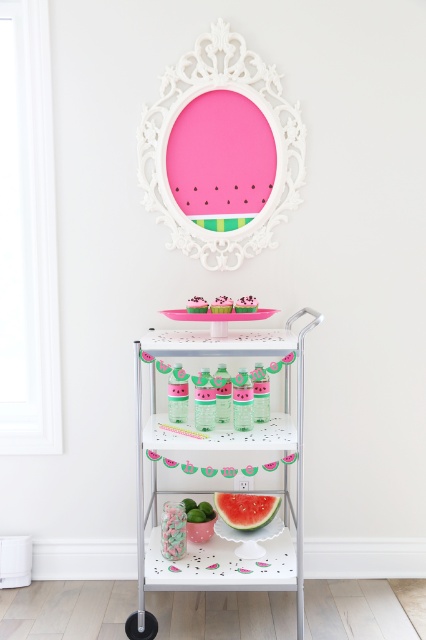
Question: Which point is closer to the camera?

Choices:
 (A) (242, 506)
 (B) (201, 518)
 (C) (204, 506)

Answer: (B)

Question: Which point is closer to the camera taking this photo?

Choices:
 (A) (271, 502)
 (B) (210, 516)
 (C) (287, 362)
 (D) (203, 513)

Answer: (C)

Question: From the image, what is the correct spatial relationship of black rubber wheel at lower left in relation to green matte lime at lower center?

Choices:
 (A) below
 (B) above

Answer: (A)

Question: Among these points, which one is farthest from the camera?

Choices:
 (A) (252, 522)
 (B) (206, 518)

Answer: (A)

Question: Is watermelon matte at lower center thinner than green matte lime at lower center?

Choices:
 (A) no
 (B) yes

Answer: (A)

Question: Does watermelon matte at lower center have a larger size compared to black rubber wheel at lower left?

Choices:
 (A) yes
 (B) no

Answer: (A)